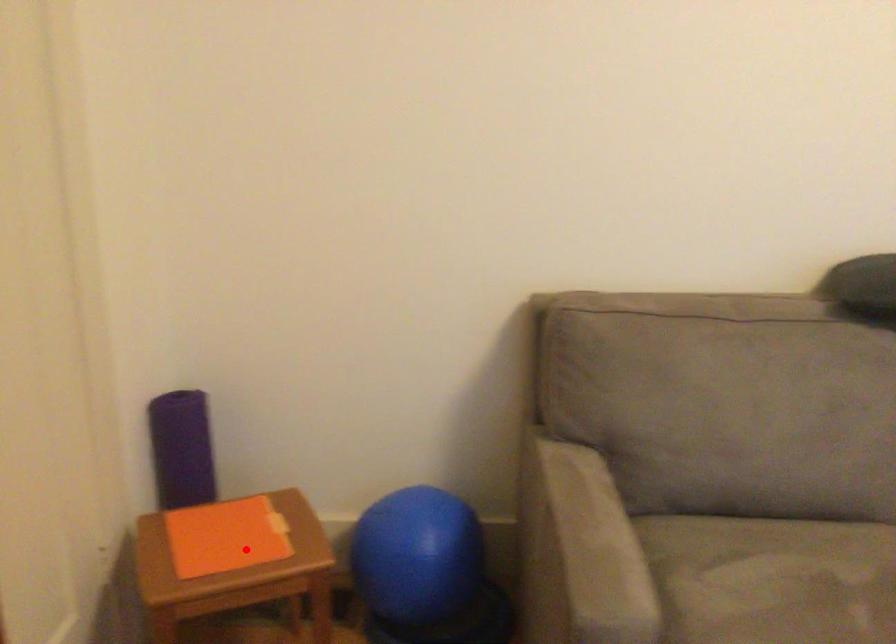
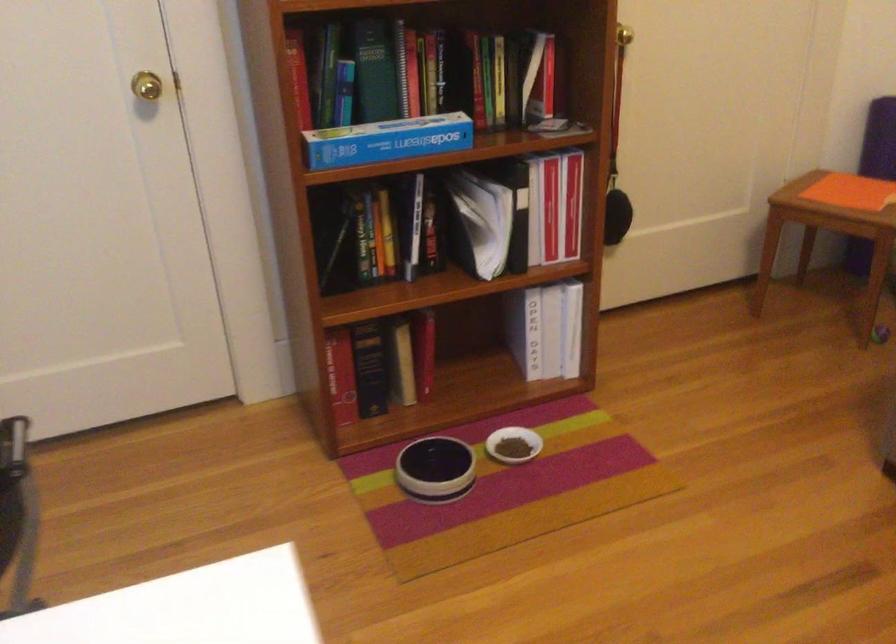
In the second image, find the point that corresponds to the highlighted location in the first image.

(840, 196)